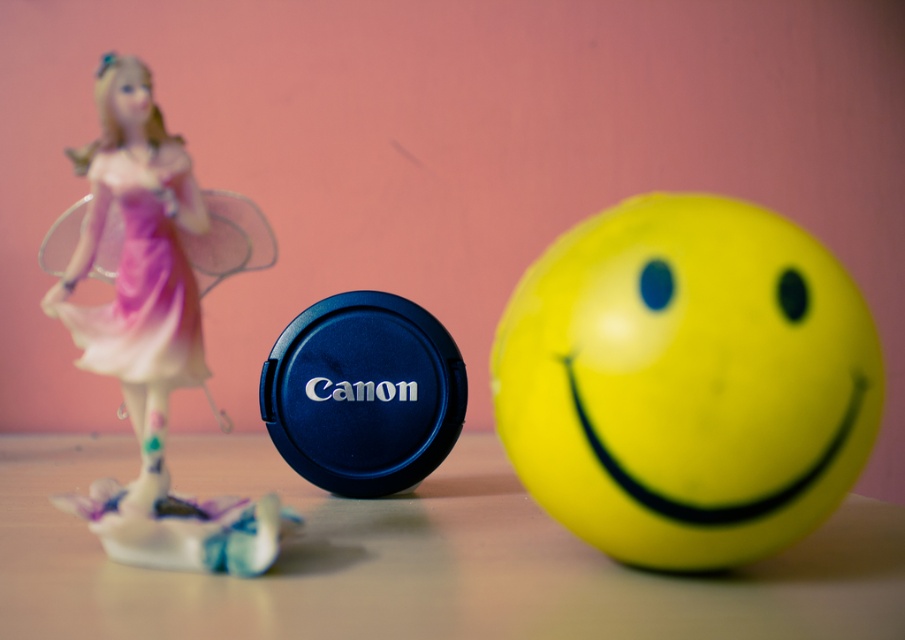
Question: Is translucent plastic fairy at left smaller than translucent plastic face at upper left?

Choices:
 (A) yes
 (B) no

Answer: (B)

Question: Considering the relative positions of translucent plastic fairy at left and pink satin dress at left in the image provided, where is translucent plastic fairy at left located with respect to pink satin dress at left?

Choices:
 (A) left
 (B) right

Answer: (B)

Question: Considering the real-world distances, which object is farthest from the yellow rubber ball at center?

Choices:
 (A) pink satin dress at left
 (B) translucent plastic face at upper left

Answer: (B)

Question: Considering the real-world distances, which object is farthest from the translucent plastic face at upper left?

Choices:
 (A) translucent plastic fairy at left
 (B) yellow rubber ball at center
 (C) pink satin dress at left

Answer: (B)

Question: In this image, where is yellow rubber ball at center located relative to translucent plastic fairy at left?

Choices:
 (A) below
 (B) above

Answer: (A)

Question: Estimate the real-world distances between objects in this image. Which object is closer to the translucent plastic fairy at left?

Choices:
 (A) translucent plastic face at upper left
 (B) yellow rubber ball at center

Answer: (A)